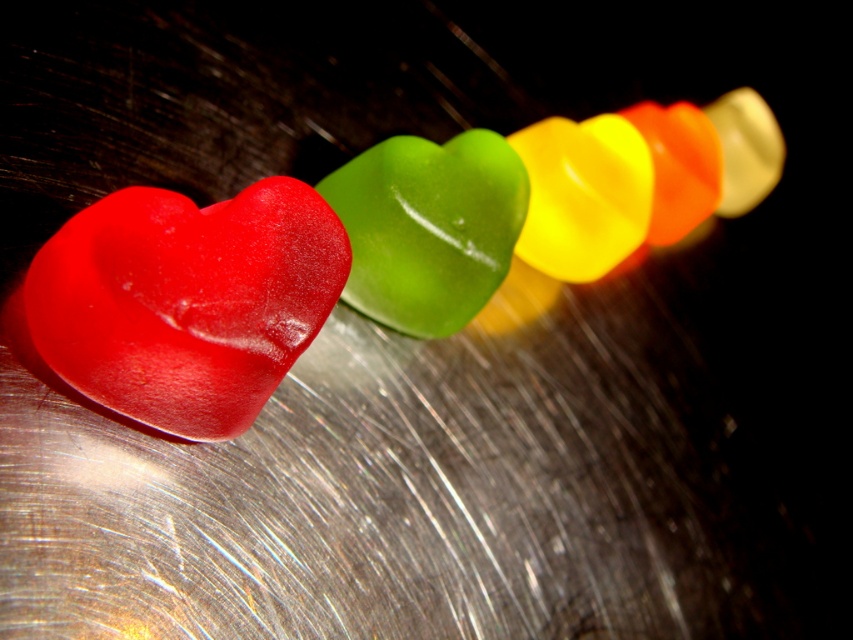
Which of these two, glossy gelatin heart at left or matte red heart at left, stands taller?

glossy gelatin heart at left

Who is positioned more to the left, glossy gelatin heart at left or matte red heart at left?

matte red heart at left

Where is `glossy gelatin heart at left`? glossy gelatin heart at left is located at coordinates [370, 250].

Can you confirm if glossy gelatin heart at left is positioned below glossy gelatin heart at center?

Incorrect, glossy gelatin heart at left is not positioned below glossy gelatin heart at center.

Where is `glossy gelatin heart at left`? glossy gelatin heart at left is located at coordinates (370, 250).

Based on the photo, which is below, matte red heart at left or glossy gelatin heart at center?

Positioned lower is matte red heart at left.

The width and height of the screenshot is (853, 640). In order to click on matte red heart at left in this screenshot , I will do `click(186, 300)`.

Locate an element on the screen. This screenshot has width=853, height=640. matte red heart at left is located at coordinates (186, 300).